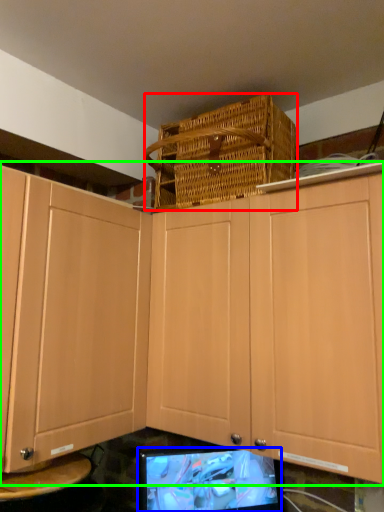
Question: Considering the real-world distances, which object is farthest from basket (highlighted by a red box)? computer monitor (highlighted by a blue box) or cabinetry (highlighted by a green box)?

Choices:
 (A) computer monitor
 (B) cabinetry

Answer: (A)